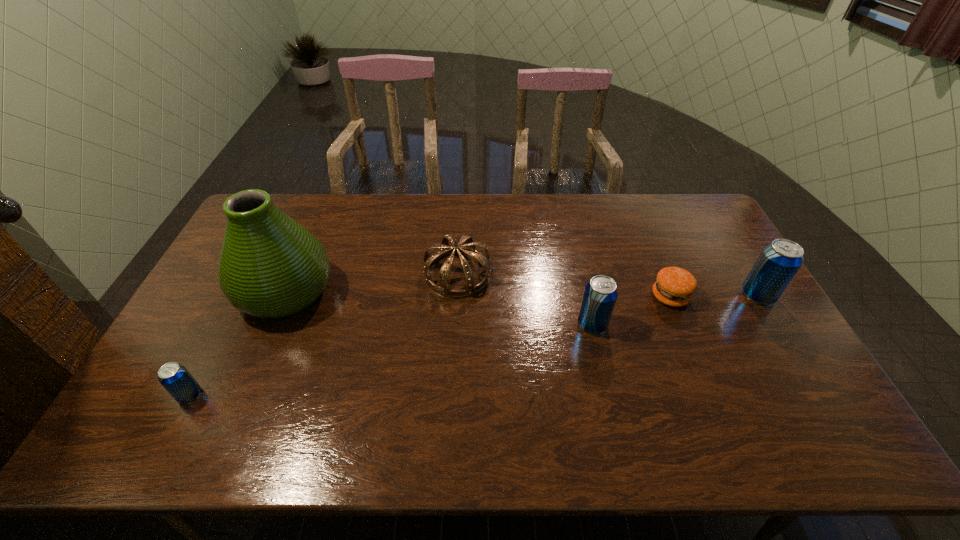
Identify the location of free space located 0.240m on the back of the shortest beer can. (232, 313).

Where is `vacant space located on the back of the second tallest beer can`? vacant space located on the back of the second tallest beer can is located at coordinates (579, 266).

Locate an element on the screen. The height and width of the screenshot is (540, 960). blank space located on the back of the farthest beer can is located at coordinates (705, 207).

I want to click on free space located on the back of the tallest object, so click(306, 243).

In order to click on vacant space located 0.110m on the right of the tiara in this screenshot , I will do `click(525, 274)`.

Locate an element on the screen. free region located on the right of the shortest object is located at coordinates (734, 296).

Identify the location of object at the near edge. This screenshot has width=960, height=540. (174, 377).

Locate an element on the screen. Image resolution: width=960 pixels, height=540 pixels. beer can that is at the left edge is located at coordinates (174, 377).

At what (x,y) coordinates should I click in order to perform the action: click on vase that is at the left edge. Please return your answer as a coordinate pair (x, y). Looking at the image, I should click on (270, 266).

This screenshot has height=540, width=960. Identify the location of object that is positioned at the right edge. (779, 261).